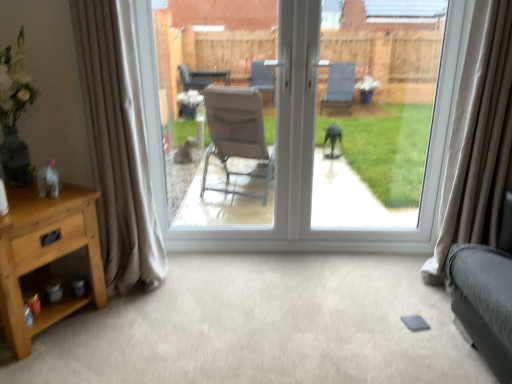
Question: Would you say light brown wood nightstand at lower left is a long distance from transparent glass window at center?

Choices:
 (A) yes
 (B) no

Answer: (A)

Question: Is light brown wood nightstand at lower left wider than transparent glass window at center?

Choices:
 (A) yes
 (B) no

Answer: (A)

Question: Is transparent glass window at center inside light brown wood nightstand at lower left?

Choices:
 (A) no
 (B) yes

Answer: (A)

Question: Is light brown wood nightstand at lower left behind transparent glass window at center?

Choices:
 (A) no
 (B) yes

Answer: (A)

Question: Considering the relative sizes of light brown wood nightstand at lower left and transparent glass window at center in the image provided, is light brown wood nightstand at lower left bigger than transparent glass window at center?

Choices:
 (A) no
 (B) yes

Answer: (B)

Question: Is light brown wood nightstand at lower left to the left of transparent glass window at center from the viewer's perspective?

Choices:
 (A) no
 (B) yes

Answer: (B)

Question: Can you confirm if beige velvet curtain at right, which appears as the first curtain when viewed from the right, is bigger than light brown wood nightstand at lower left?

Choices:
 (A) no
 (B) yes

Answer: (B)

Question: Is beige velvet curtain at right, which appears as the first curtain when viewed from the right, aimed at light brown wood nightstand at lower left?

Choices:
 (A) no
 (B) yes

Answer: (A)

Question: Is beige velvet curtain at right, which appears as the first curtain when viewed from the right, far away from light brown wood nightstand at lower left?

Choices:
 (A) no
 (B) yes

Answer: (B)

Question: From a real-world perspective, is beige velvet curtain at right, which appears as the first curtain when viewed from the right, positioned over light brown wood nightstand at lower left based on gravity?

Choices:
 (A) yes
 (B) no

Answer: (A)

Question: Does beige velvet curtain at right, the second curtain in the left-to-right sequence, touch light brown wood nightstand at lower left?

Choices:
 (A) yes
 (B) no

Answer: (B)

Question: From the image's perspective, is beige velvet curtain at right, the second curtain in the left-to-right sequence, under light brown wood nightstand at lower left?

Choices:
 (A) yes
 (B) no

Answer: (B)

Question: Does transparent glass door at center turn towards beige velvet curtain at right, the second curtain in the left-to-right sequence?

Choices:
 (A) no
 (B) yes

Answer: (B)